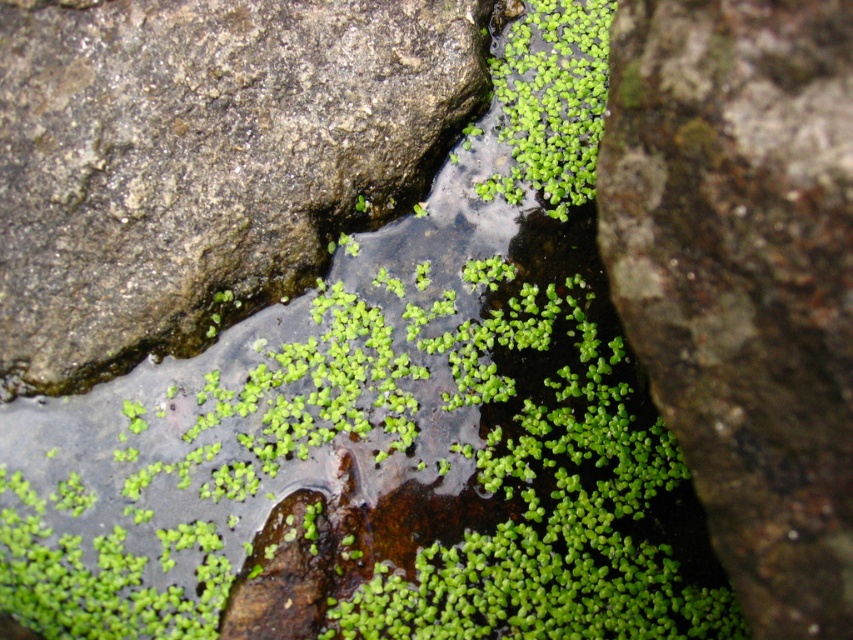
Is the position of green mossy rock at center less distant than that of green leafy plant at upper center?

That is True.

I want to click on green mossy rock at center, so click(x=743, y=278).

Who is taller, gray rough rock at upper left or green leafy plant at upper center?

gray rough rock at upper left

Is point (347, 113) in front of point (556, 212)?

Yes, it is.

Is point (194, 342) positioned before point (561, 166)?

That is True.

What are the coordinates of `gray rough rock at upper left` in the screenshot? It's located at (202, 161).

Is gray rough rock at upper left closer to the viewer compared to green mossy rock at center?

No, it is not.

Does gray rough rock at upper left have a greater height compared to green mossy rock at center?

Yes, gray rough rock at upper left is taller than green mossy rock at center.

Is point (99, 145) positioned in front of point (784, 108)?

No, (99, 145) is behind (784, 108).

The height and width of the screenshot is (640, 853). What are the coordinates of `gray rough rock at upper left` in the screenshot? It's located at (202, 161).